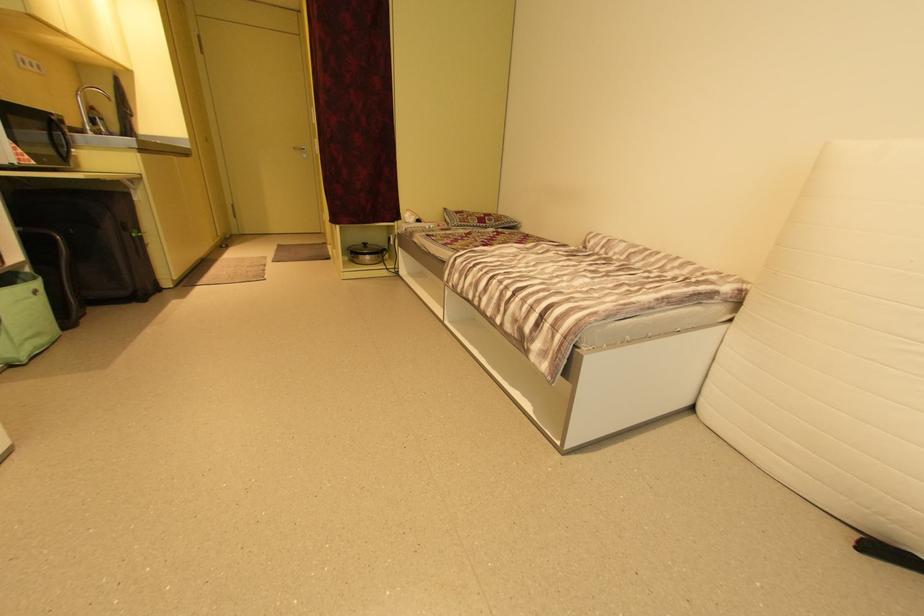
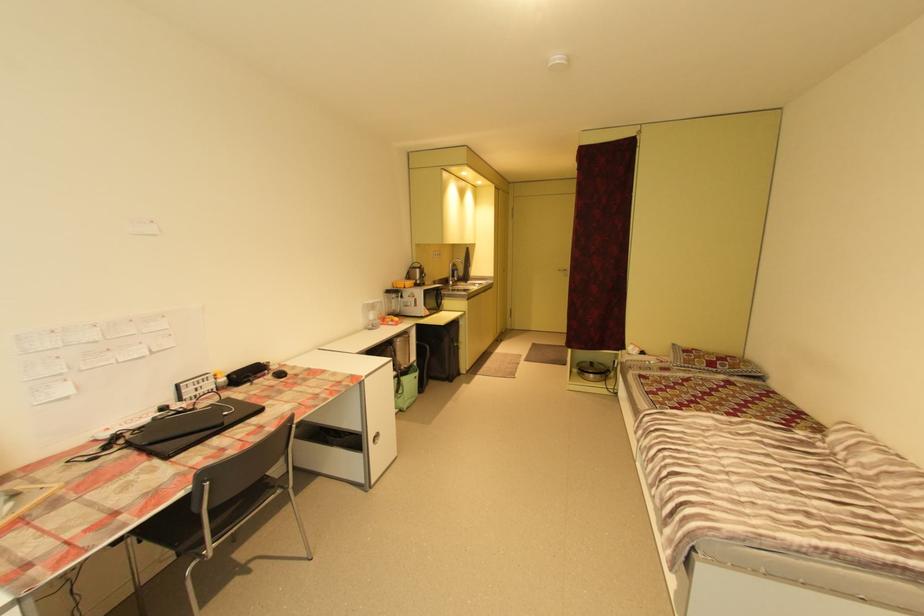
Locate, in the second image, the point that corresponds to point (371, 245) in the first image.

(598, 363)